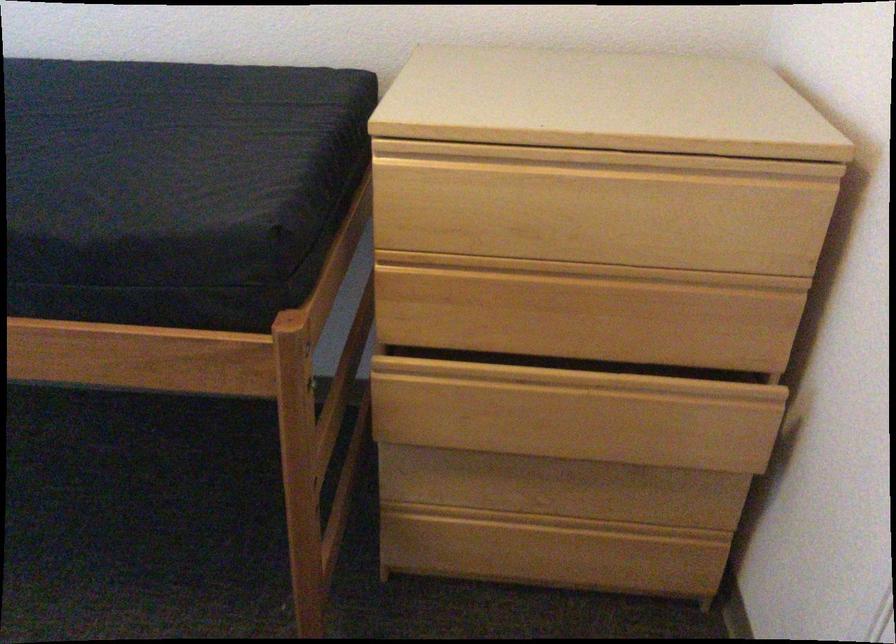
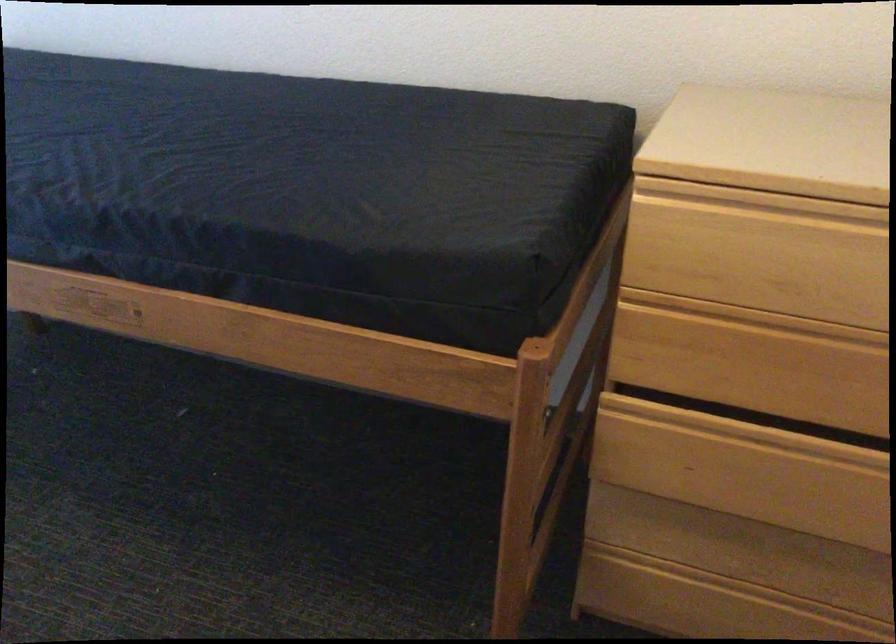
Question: The images are taken continuously from a first-person perspective. In which direction are you moving?

Choices:
 (A) Left
 (B) Right
 (C) Forward
 (D) Backward

Answer: (A)